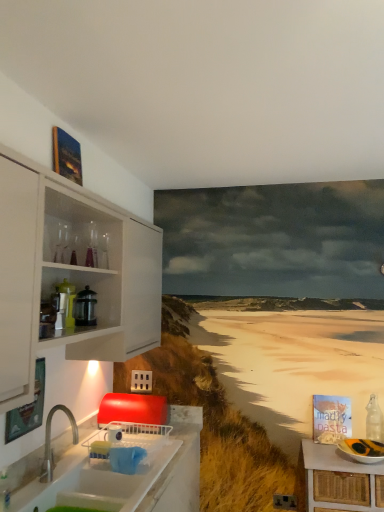
Question: Considering the relative sizes of clear glass bottle at right and white glossy countertop at lower left in the image provided, is clear glass bottle at right wider than white glossy countertop at lower left?

Choices:
 (A) no
 (B) yes

Answer: (A)

Question: Is clear glass bottle at right next to white glossy countertop at lower left and touching it?

Choices:
 (A) yes
 (B) no

Answer: (B)

Question: Considering the relative sizes of clear glass bottle at right and white glossy countertop at lower left in the image provided, is clear glass bottle at right shorter than white glossy countertop at lower left?

Choices:
 (A) no
 (B) yes

Answer: (B)

Question: Can you confirm if clear glass bottle at right is positioned to the right of white glossy countertop at lower left?

Choices:
 (A) yes
 (B) no

Answer: (A)

Question: Is clear glass bottle at right facing away from white glossy countertop at lower left?

Choices:
 (A) yes
 (B) no

Answer: (B)

Question: From a real-world perspective, is clear glass bottle at right positioned over white glossy countertop at lower left based on gravity?

Choices:
 (A) yes
 (B) no

Answer: (B)

Question: From a real-world perspective, does white wicker table at lower right sit lower than clear glass bottle at right?

Choices:
 (A) no
 (B) yes

Answer: (B)

Question: Is white wicker table at lower right located outside clear glass bottle at right?

Choices:
 (A) no
 (B) yes

Answer: (B)

Question: Considering the relative positions of white wicker table at lower right and clear glass bottle at right in the image provided, is white wicker table at lower right to the left of clear glass bottle at right from the viewer's perspective?

Choices:
 (A) yes
 (B) no

Answer: (A)

Question: Does white wicker table at lower right have a greater width compared to clear glass bottle at right?

Choices:
 (A) no
 (B) yes

Answer: (B)

Question: Is white wicker table at lower right positioned before clear glass bottle at right?

Choices:
 (A) no
 (B) yes

Answer: (B)

Question: Is white wicker table at lower right oriented away from clear glass bottle at right?

Choices:
 (A) no
 (B) yes

Answer: (A)

Question: Does white wicker table at lower right have a lesser height compared to white glossy countertop at lower left?

Choices:
 (A) no
 (B) yes

Answer: (B)